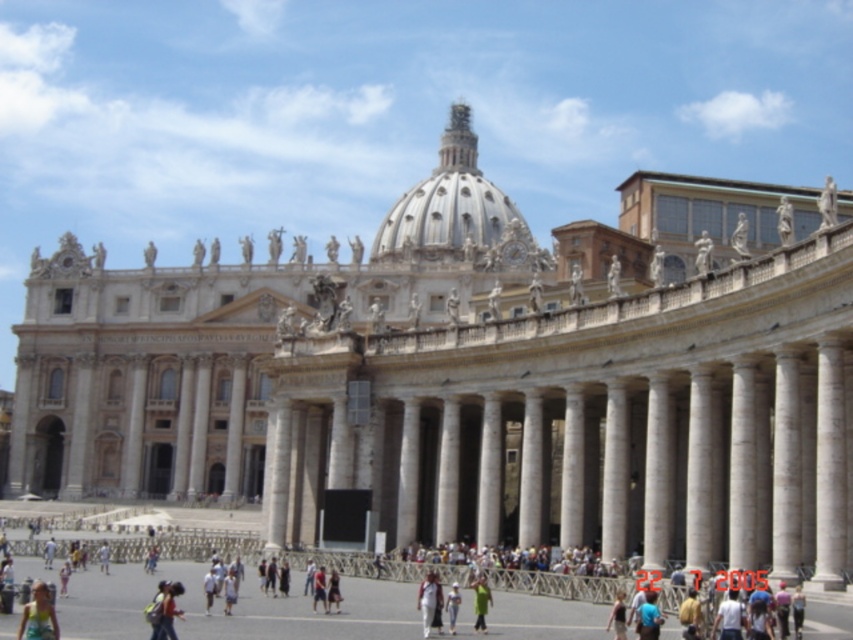
You are standing in front of the grand building and see a light brown fabric bag at lower center and a green matte jacket at center. Which object is closer to you?

The light brown fabric bag at lower center is closer to you since it is in front of the green matte jacket at center.